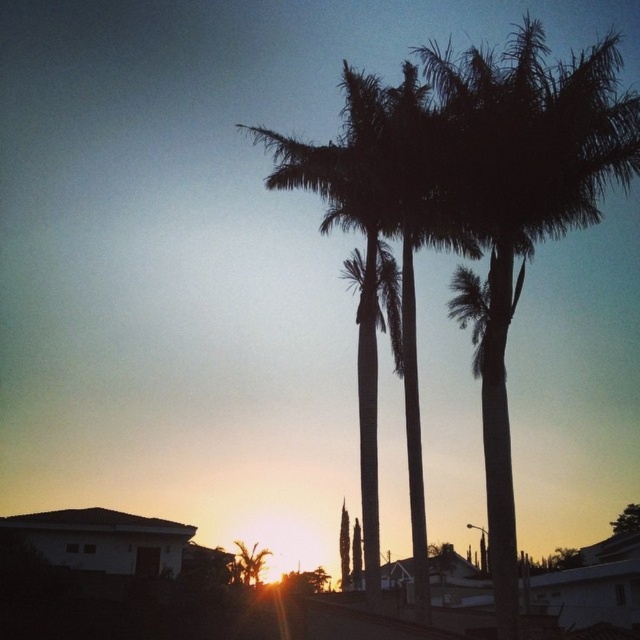
Does silhouette leafy palm at upper center have a larger size compared to green leafy tree at upper center?

Yes, silhouette leafy palm at upper center is bigger than green leafy tree at upper center.

Is silhouette leafy palm at upper center positioned at the back of green leafy tree at upper center?

No, silhouette leafy palm at upper center is closer to the viewer.

Is point (512, 256) positioned in front of point (618, 532)?

That is True.

The height and width of the screenshot is (640, 640). What are the coordinates of `silhouette leafy palm at upper center` in the screenshot? It's located at (525, 204).